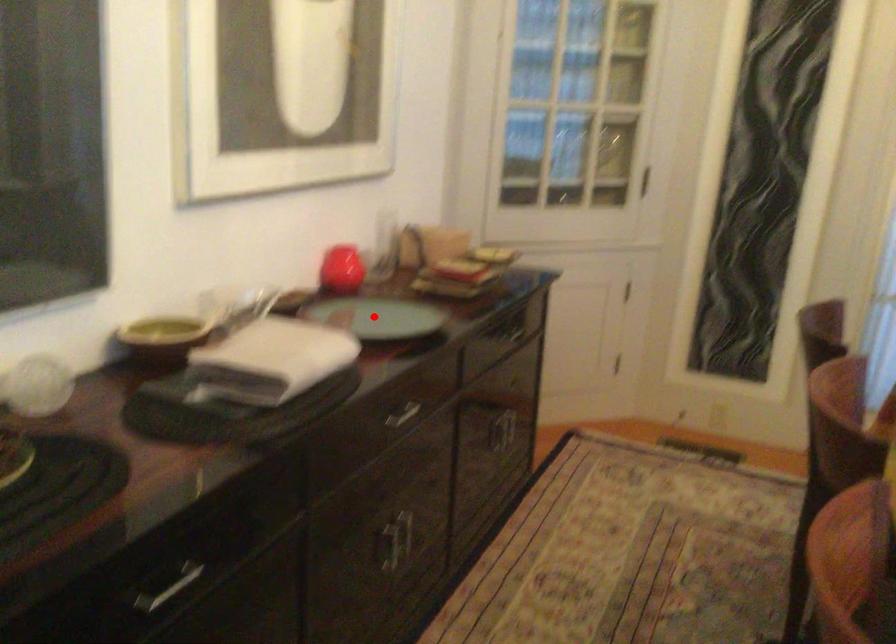
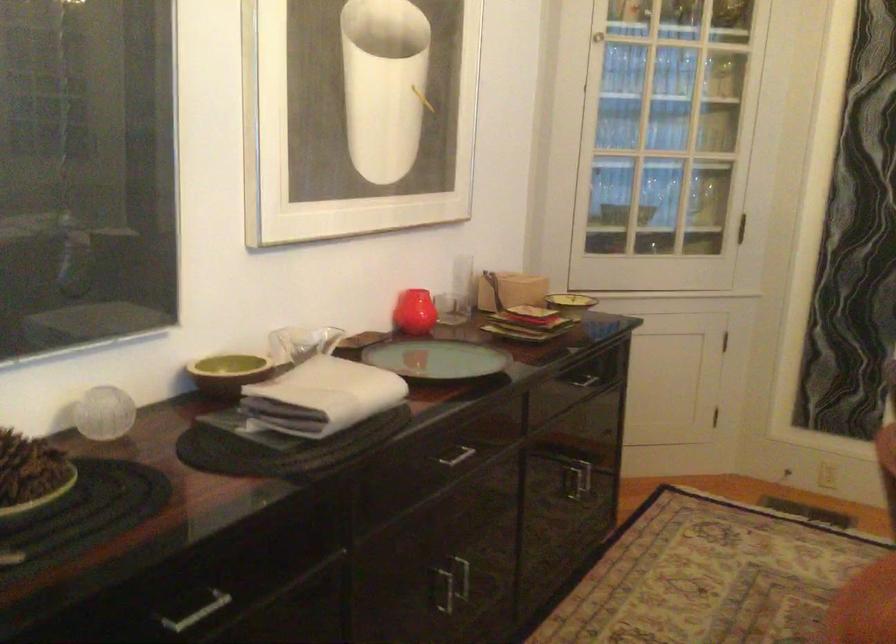
The point at the highlighted location is marked in the first image. Where is the corresponding point in the second image?

(436, 359)